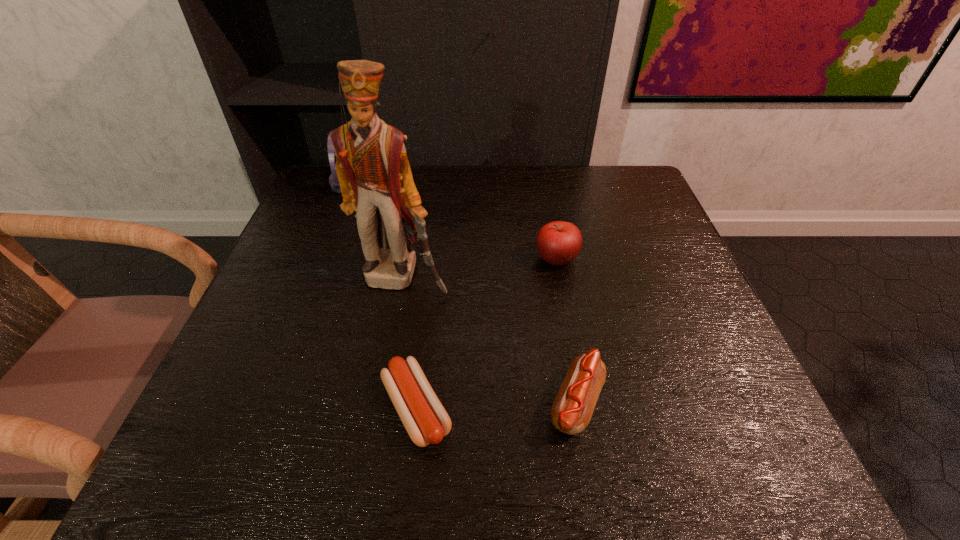
Select which object appears as the fourth closest to the nutcracker. Please provide its 2D coordinates. Your answer should be formatted as a tuple, i.e. [(x, y)], where the tuple contains the x and y coordinates of a point satisfying the conditions above.

[(333, 179)]

At what (x,y) coordinates should I click in order to perform the action: click on object that is the second nearest to the left sausage. Please return your answer as a coordinate pair (x, y). Looking at the image, I should click on (373, 170).

Find the location of a particular element. free space that satisfies the following two spatial constraints: 1. on the headband and ear cups of the taller sausage; 2. on the right side of the farthest object is located at coordinates (258, 404).

Identify the location of free region that satisfies the following two spatial constraints: 1. on the headband and ear cups of the farthest object; 2. on the left side of the apple. (317, 260).

Locate an element on the screen. This screenshot has height=540, width=960. vacant space that satisfies the following two spatial constraints: 1. on the headband and ear cups of the left sausage; 2. on the left side of the leftmost object is located at coordinates (257, 409).

Where is `free space that satisfies the following two spatial constraints: 1. on the back side of the third tallest object; 2. on the right side of the taller sausage`? Image resolution: width=960 pixels, height=540 pixels. free space that satisfies the following two spatial constraints: 1. on the back side of the third tallest object; 2. on the right side of the taller sausage is located at coordinates (551, 260).

Find the location of a particular element. The height and width of the screenshot is (540, 960). free space in the image that satisfies the following two spatial constraints: 1. on the back side of the shortest object; 2. on the headband and ear cups of the second tallest object is located at coordinates (442, 185).